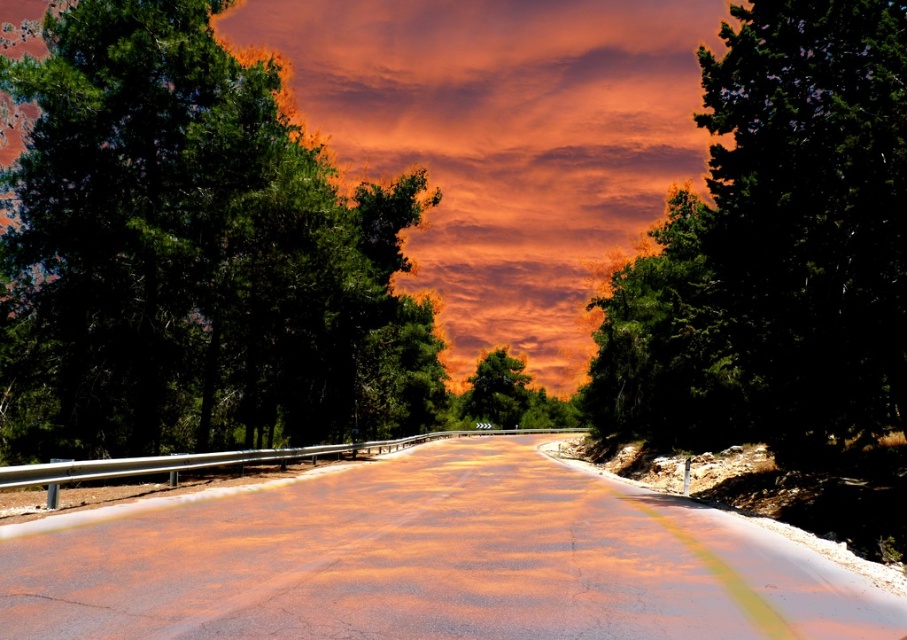
You are driving a car and see the green matte tree at left and the orange cotton clouds at center in your view. Which object is closer to your car?

The green matte tree at left is closer to your car because it is in front of the orange cotton clouds at center.

You are driving a car and want to know which of the two points, point (271, 545) or point (379, 12), is closer to your current position. Based on the scene, which point is nearer to you?

Point (271, 545) is closer to the camera than point (379, 12), so it is nearer to your current position.

You are a photographer standing at the starting point of the road. You want to take a photo that includes both the point at coordinates point (57,532) and point (496,394). Which point will appear larger in the photo?

Point (57,532) is closer to the camera than point (496,394), so it will appear larger in the photo.